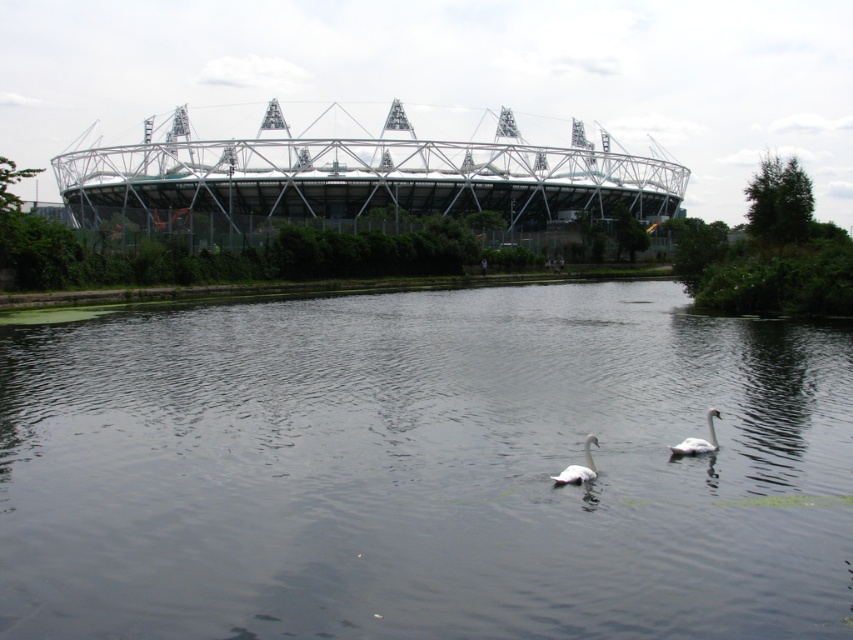
You are standing at the edge of the water and want to locate the transparent water at center. According to the coordinates provided, where would you find it?

The transparent water at center is located at the coordinates point (425, 468).

You are a photographer standing at the edge of the water, holding a camera. You want to capture a closeup shot of the white feathered swan at center. Based on the scene description, can you estimate whether you can get a clear closeup without moving closer than your current position?

The white feathered swan at center and camera are 12.17 meters apart. At this distance, capturing a clear closeup shot would require a telephoto lens to avoid needing to move closer than your current position.

Based on the photo, you are a photographer trying to capture both the white feathered swan at center and the white matte swan at lower center in a single shot. Based on their positions, which swan is positioned more to the left side of the image?

The white feathered swan at center is positioned more to the left side of the image compared to the white matte swan at lower center.